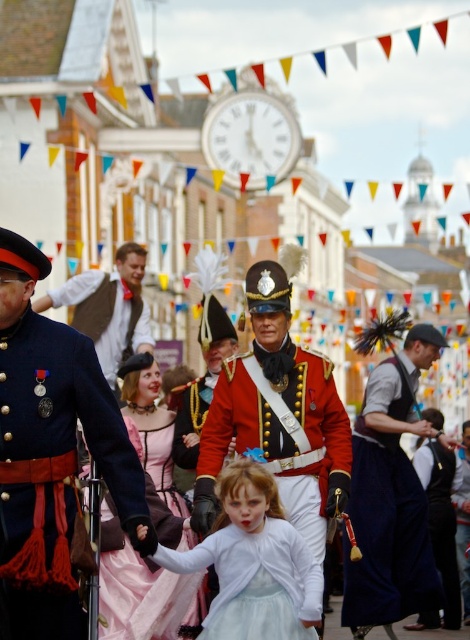
Is point (284, 406) more distant than point (135, 269)?

No, it is not.

Does shiny red uniform at center appear under matte brown vest at center?

Correct, shiny red uniform at center is located below matte brown vest at center.

Measure the distance between shiny red uniform at center and camera.

shiny red uniform at center is 207.63 feet from camera.

What are the coordinates of `shiny red uniform at center` in the screenshot? It's located at pyautogui.click(x=279, y=413).

Is point (99, 604) positioned after point (109, 352)?

No, (99, 604) is in front of (109, 352).

Which is behind, point (155, 488) or point (124, 314)?

The point (124, 314) is behind.

I want to click on pink satin dress at center, so click(x=136, y=588).

Which is more to the left, shiny gold uniform at center or velvet black vest at lower right?

shiny gold uniform at center

Can you confirm if shiny gold uniform at center is wider than velvet black vest at lower right?

Indeed, shiny gold uniform at center has a greater width compared to velvet black vest at lower right.

Does point (62, 625) lie in front of point (448, 484)?

Yes.

This screenshot has width=470, height=640. I want to click on shiny gold uniform at center, so point(49,451).